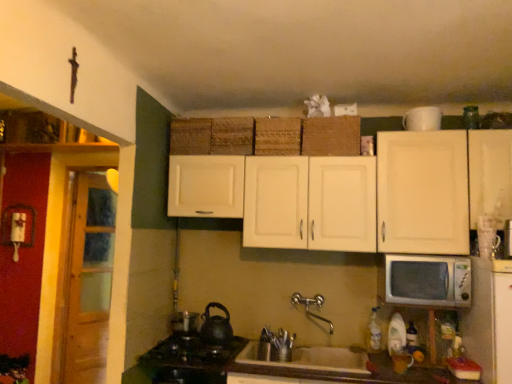
Measure the distance between point (211, 136) and camera.

A distance of 8.98 feet exists between point (211, 136) and camera.

What do you see at coordinates (232, 136) in the screenshot? The image size is (512, 384). I see `woven brown basket at center, the 3th basket when ordered from right to left` at bounding box center [232, 136].

Describe the element at coordinates (311, 359) in the screenshot. I see `white porcelain sink at center` at that location.

This screenshot has height=384, width=512. What do you see at coordinates (192, 352) in the screenshot?
I see `black matte gas stove at lower left` at bounding box center [192, 352].

Image resolution: width=512 pixels, height=384 pixels. I want to click on white matte mug at upper right, so pyautogui.click(x=423, y=119).

Image resolution: width=512 pixels, height=384 pixels. I want to click on woven brown basket at center, acting as the second basket starting from the left, so click(x=232, y=136).

Can you tell me how much white matte mug at upper right and woven brown basket at upper center, the fourth basket from the right, differ in facing direction?

There is a 3.77-degree angle between the facing directions of white matte mug at upper right and woven brown basket at upper center, the fourth basket from the right.

Is woven brown basket at upper center, which is counted as the first basket, starting from the left, located within white matte mug at upper right?

Actually, woven brown basket at upper center, which is counted as the first basket, starting from the left, is outside white matte mug at upper right.

Would you consider white matte mug at upper right to be distant from woven brown basket at upper center, which is counted as the first basket, starting from the left?

Yes, white matte mug at upper right is far from woven brown basket at upper center, which is counted as the first basket, starting from the left.

From a real-world perspective, is white matte mug at upper right physically above woven brown basket at upper center, the fourth basket from the right?

Yes, from a real-world perspective, white matte mug at upper right is over woven brown basket at upper center, the fourth basket from the right

In the scene shown: In terms of size, does wooden at left appear bigger or smaller than woven brown basket at upper center, which is counted as the first basket, starting from the left?

wooden at left is bigger than woven brown basket at upper center, which is counted as the first basket, starting from the left.

Between wooden at left and woven brown basket at upper center, the fourth basket from the right, which one appears on the right side from the viewer's perspective?

woven brown basket at upper center, the fourth basket from the right.

Can you confirm if wooden at left is shorter than woven brown basket at upper center, the fourth basket from the right?

No.

How different are the orientations of wooden at left and woven brown basket at upper center, the fourth basket from the right, in degrees?

61.4 degrees separate the facing orientations of wooden at left and woven brown basket at upper center, the fourth basket from the right.

Is black matte tea pot at lower center next to white matte sink at lower center and touching it?

No, black matte tea pot at lower center is not in contact with white matte sink at lower center.

Measure the distance between black matte tea pot at lower center and white matte sink at lower center.

black matte tea pot at lower center is 11.04 inches from white matte sink at lower center.

Does black matte tea pot at lower center have a smaller size compared to white matte sink at lower center?

Correct, black matte tea pot at lower center occupies less space than white matte sink at lower center.

Is black matte tea pot at lower center in front of or behind white matte sink at lower center in the image?

Clearly, black matte tea pot at lower center is behind white matte sink at lower center.

Looking at this image, is black matte tea pot at lower center inside or outside of white porcelain sink at center?

black matte tea pot at lower center lies outside white porcelain sink at center.

Is black matte tea pot at lower center facing away from white porcelain sink at center?

No.

Is black matte tea pot at lower center further to the viewer compared to white porcelain sink at center?

Yes, black matte tea pot at lower center is behind white porcelain sink at center.

Is black matte gas stove at lower left touching brown woven basket at upper center, which is counted as the first basket, starting from the right?

No, black matte gas stove at lower left is not in contact with brown woven basket at upper center, which is counted as the first basket, starting from the right.

Can we say black matte gas stove at lower left lies outside brown woven basket at upper center, which is counted as the first basket, starting from the right?

Indeed, black matte gas stove at lower left is completely outside brown woven basket at upper center, which is counted as the first basket, starting from the right.

Which point is more forward, (x=194, y=341) or (x=337, y=140)?

The point (x=194, y=341) is closer to the camera.

Where is `gas stove that is below the brown woven basket at upper center, which ranks as the 4th basket in left-to-right order (from the image's perspective)`? gas stove that is below the brown woven basket at upper center, which ranks as the 4th basket in left-to-right order (from the image's perspective) is located at coordinates (192, 352).

Between point (238, 358) and point (452, 267), which one is positioned behind?

The point (238, 358) is farther.

How many degrees apart are the facing directions of white porcelain sink at center and white plastic microwave at right?

The angular difference between white porcelain sink at center and white plastic microwave at right is 0.811 degrees.

From a real-world perspective, is white porcelain sink at center physically above white plastic microwave at right?

Incorrect, from a real-world perspective, white porcelain sink at center is lower than white plastic microwave at right.

Choose the correct answer: Is white porcelain sink at center inside white plastic microwave at right or outside it?

white porcelain sink at center is not enclosed by white plastic microwave at right.

Is brown woven basket at upper center, which is counted as the first basket, starting from the right, next to black matte tea pot at lower center?

brown woven basket at upper center, which is counted as the first basket, starting from the right, and black matte tea pot at lower center are clearly separated.

Considering the positions of point (340, 131) and point (209, 321), is point (340, 131) closer or farther from the camera than point (209, 321)?

Clearly, point (340, 131) is more distant from the camera than point (209, 321).

From the picture: Choose the correct answer: Is brown woven basket at upper center, which ranks as the 4th basket in left-to-right order, inside black matte tea pot at lower center or outside it?

brown woven basket at upper center, which ranks as the 4th basket in left-to-right order, is not inside black matte tea pot at lower center, it's outside.

Considering the relative sizes of brown woven basket at upper center, which is counted as the first basket, starting from the right, and black matte tea pot at lower center in the image provided, is brown woven basket at upper center, which is counted as the first basket, starting from the right, taller than black matte tea pot at lower center?

Yes.

Image resolution: width=512 pixels, height=384 pixels. I want to click on appliance above the woven brown basket at upper center, which is counted as the first basket, starting from the left (from a real-world perspective), so click(x=423, y=119).

In the image, there is a woven brown basket at upper center, which is counted as the first basket, starting from the left. Find the location of `door below it (from the image's perspective)`. door below it (from the image's perspective) is located at coordinates (89, 281).

Looking at the image, which one is located further to woven brown basket at upper center, the fourth basket from the right, black matte tea pot at lower center or white matte mug at upper right?

white matte mug at upper right.

From the image, which object appears to be farther from woven brown basket at upper center, which is counted as the first basket, starting from the left, brown woven basket at upper center, which is counted as the first basket, starting from the right, or woven brown basket at center, acting as the second basket starting from the left?

Based on the image, brown woven basket at upper center, which is counted as the first basket, starting from the right, appears to be further to woven brown basket at upper center, which is counted as the first basket, starting from the left.

Which object lies nearer to the anchor point white matte cabinet at upper center, woven brown basket at upper center, the fourth basket from the right, or white matte mug at upper right?

white matte mug at upper right is positioned closer to the anchor white matte cabinet at upper center.

Based on their spatial positions, is white porcelain sink at center or woven brown basket at upper center, the fourth basket from the right, further from brown woven basket at upper center, which is counted as the first basket, starting from the right?

Based on the image, white porcelain sink at center appears to be further to brown woven basket at upper center, which is counted as the first basket, starting from the right.

From the image, which object appears to be nearer to white matte sink at lower center, white porcelain sink at center or woven straw basket at center, arranged as the second basket when viewed from the right?

white porcelain sink at center.

In the scene shown: Looking at the image, which one is located closer to wooden at left, woven brown basket at center, the 3th basket when ordered from right to left, or black matte tea pot at lower center?

black matte tea pot at lower center is positioned closer to the anchor wooden at left.

Which object lies further to the anchor point brown woven basket at upper center, which ranks as the 4th basket in left-to-right order, woven brown basket at center, the 3th basket when ordered from right to left, or wooden at left?

wooden at left.

Considering their positions, is black matte gas stove at lower left positioned further to white matte cabinet at upper center than brown woven basket at upper center, which ranks as the 4th basket in left-to-right order?

Among the two, black matte gas stove at lower left is located further to white matte cabinet at upper center.

The image size is (512, 384). Identify the location of tea pot located between black matte gas stove at lower left and white matte sink at lower center in the left-right direction. (216, 326).

Identify the location of tea pot between woven straw basket at center, arranged as the second basket when viewed from the right, and black matte gas stove at lower left from top to bottom. The width and height of the screenshot is (512, 384). (216, 326).

Where is `cabinetry between woven brown basket at center, acting as the second basket starting from the left, and white porcelain sink at center in the up-down direction`? This screenshot has height=384, width=512. cabinetry between woven brown basket at center, acting as the second basket starting from the left, and white porcelain sink at center in the up-down direction is located at coordinates (356, 193).

The width and height of the screenshot is (512, 384). I want to click on microwave oven between woven straw basket at center, which is the 3th basket from left to right, and white matte sink at lower center, in the vertical direction, so click(x=428, y=280).